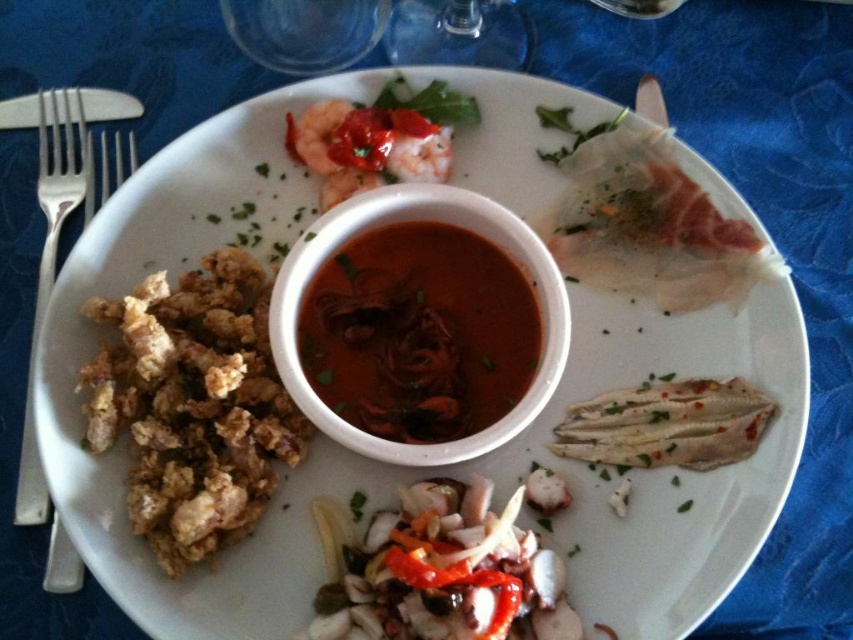
You are a food critic who needs to describe the arrangement of the slightly translucent squid at center and the white flaky fish at lower right. Which one is placed closer to the center of the plate?

The slightly translucent squid at center is positioned under the white flaky fish at lower right, meaning the squid is closer to the center of the plate.

You are a diner who wants to use the silver metallic fork at left to dip into the dark red glossy sauce at center. Can the fork reach the sauce?

The dark red glossy sauce at center has a larger size compared to silver metallic fork at left, but the question is about reachability. Since the sauce is at the center and the fork is at the left, the fork can be moved towards the center to reach the sauce. The size difference doesn not affect reachability. Therefore, yes, the fork can reach the sauce.

You are a food critic analyzing the spatial arrangement of a dish. The plate has a white plate on a blue tablecloth with various items. Where is the slightly translucent squid at center located in terms of coordinates?

The slightly translucent squid at center is located at coordinates point (445, 573).